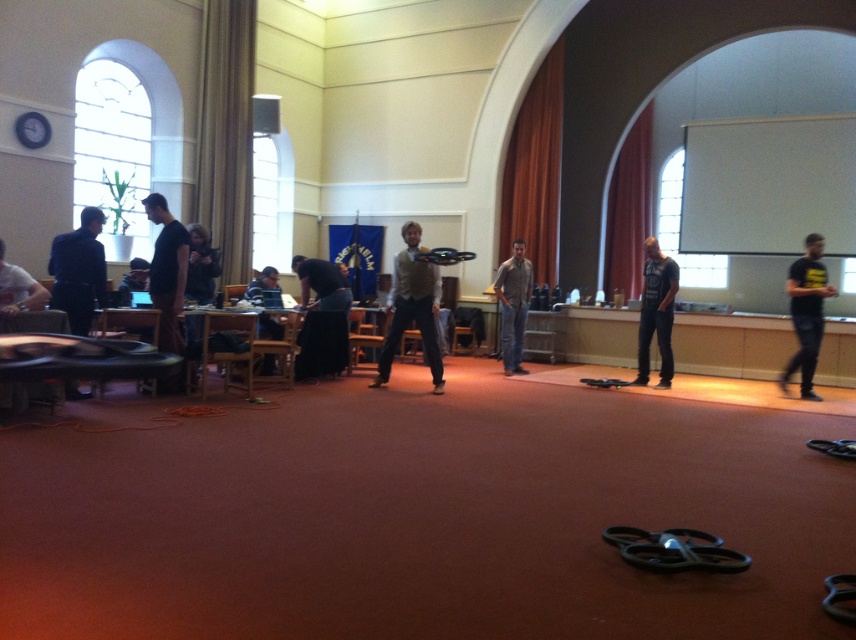
Is black t-shirt at right above white shirt at left?

Incorrect, black t-shirt at right is not positioned above white shirt at left.

Which is more to the right, black t-shirt at right or white shirt at left?

From the viewer's perspective, black t-shirt at right appears more on the right side.

Locate an element on the screen. This screenshot has width=856, height=640. black t-shirt at right is located at coordinates [806, 312].

Where is `black t-shirt at right`? black t-shirt at right is located at coordinates (806, 312).

In the scene shown: Can you confirm if dark blue shirt at left is wider than black cotton shirt at left?

Indeed, dark blue shirt at left has a greater width compared to black cotton shirt at left.

Consider the image. Is dark blue shirt at left bigger than black cotton shirt at left?

No, dark blue shirt at left is not bigger than black cotton shirt at left.

You are a GUI agent. You are given a task and a screenshot of the screen. Output one action in this format:
    pyautogui.click(x=<x>, y=<y>)
    Task: Click on the dark blue shirt at left
    
    Given the screenshot: What is the action you would take?
    pyautogui.click(x=78, y=269)

Does white matte projection screen at upper right come in front of black fabric dress at center?

No, white matte projection screen at upper right is further to the viewer.

Does point (777, 118) come behind point (317, 371)?

Yes, it is.

This screenshot has width=856, height=640. Find the location of `white matte projection screen at upper right`. white matte projection screen at upper right is located at coordinates (768, 184).